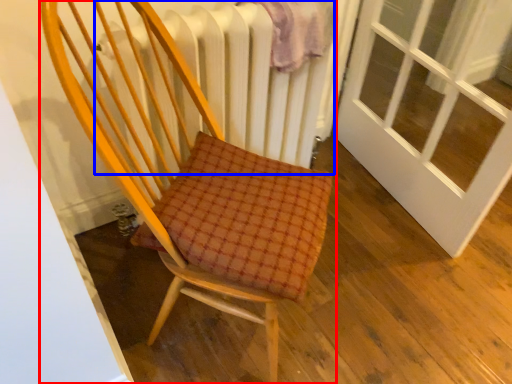
Question: Which object is further to the camera taking this photo, chair (highlighted by a red box) or radiator (highlighted by a blue box)?

Choices:
 (A) chair
 (B) radiator

Answer: (B)